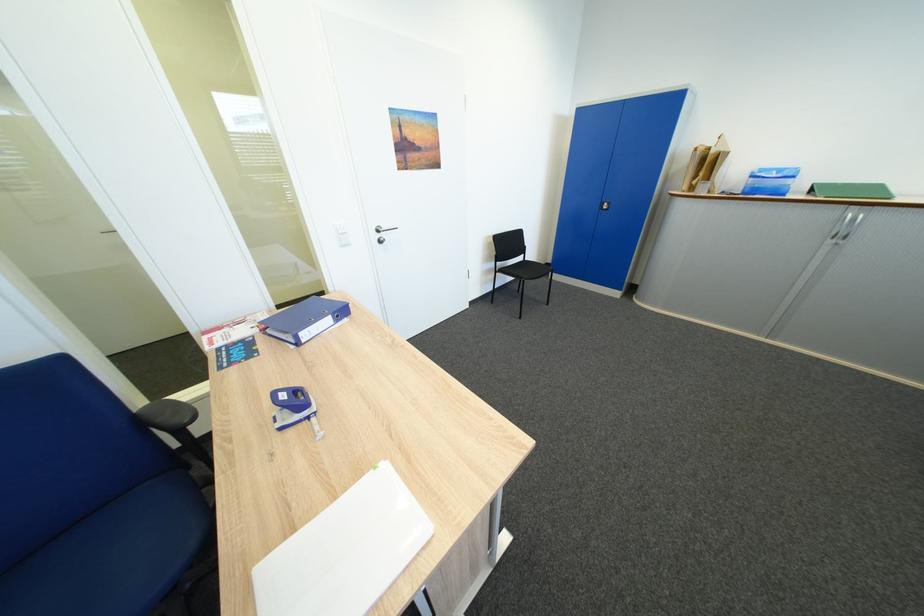
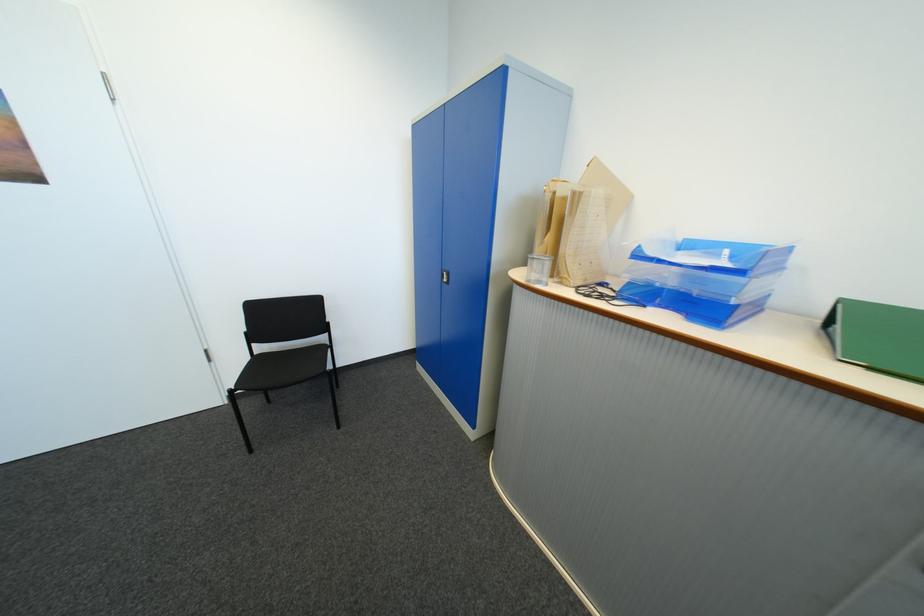
In the second image, find the point that corresponds to pixel 774 179 in the first image.

(671, 262)